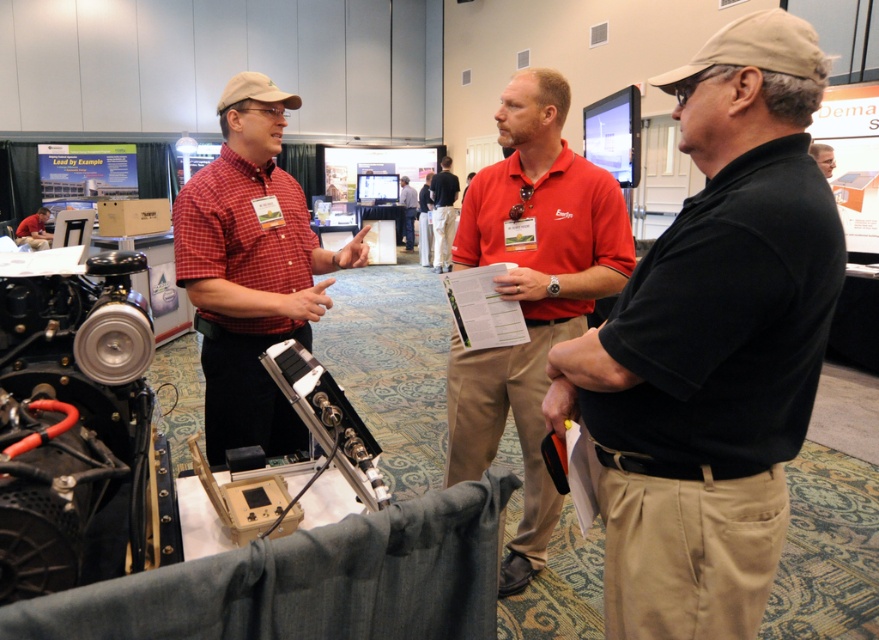
You are organizing a photo shoot and need to ensure that the khaki pants at center and the light brown leather jacket at upper right are both visible in the frame. Based on their sizes, which item might require more careful framing to avoid being cropped out?

The light brown leather jacket at upper right requires more careful framing because it occupies more space than the khaki pants at center, making it more likely to be cropped out if not positioned properly.

You are a photographer at the exhibition hall. You want to take a photo that includes both the khaki pants at center and the light brown leather jacket at upper right. Which object should you focus on first to ensure both are in frame?

The khaki pants at center is much taller than the light brown leather jacket at upper right, so you should focus on the khaki pants at center first to ensure both are in frame.